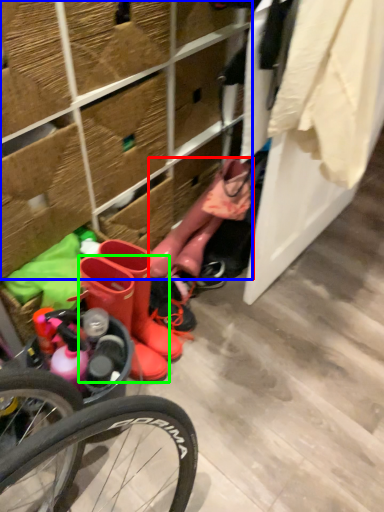
Question: Which object is the farthest from boot (highlighted by a red box)? Choose among these: shelf (highlighted by a blue box) or footwear (highlighted by a green box).

Choices:
 (A) shelf
 (B) footwear

Answer: (B)